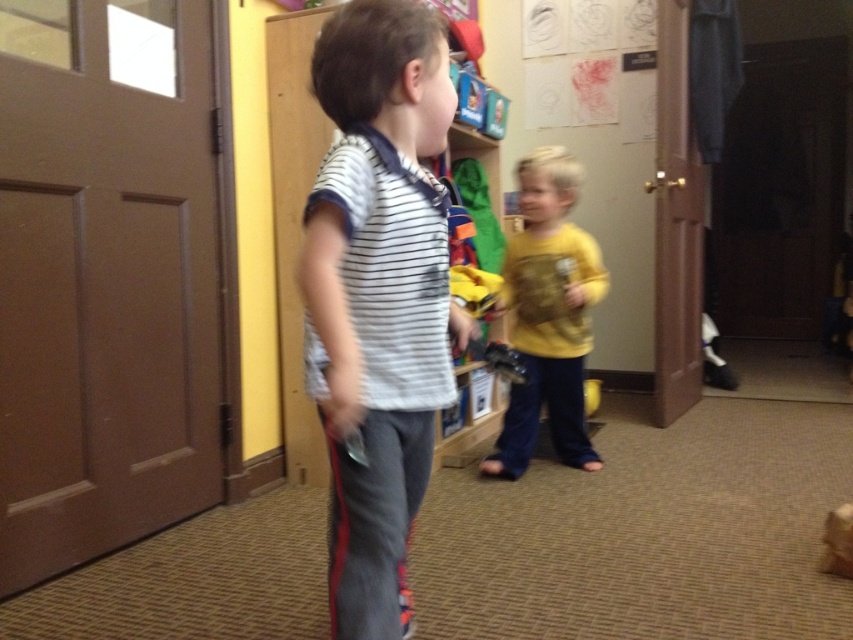
Question: Is white striped shirt at center thinner than yellow matte shirt at center?

Choices:
 (A) yes
 (B) no

Answer: (A)

Question: Does white striped shirt at center have a greater width compared to yellow matte shirt at center?

Choices:
 (A) no
 (B) yes

Answer: (A)

Question: Is the position of white striped shirt at center less distant than that of yellow matte shirt at center?

Choices:
 (A) no
 (B) yes

Answer: (B)

Question: Which point is farther from the camera taking this photo?

Choices:
 (A) (412, 493)
 (B) (508, 420)

Answer: (B)

Question: Which point is closer to the camera taking this photo?

Choices:
 (A) (532, 400)
 (B) (351, 474)

Answer: (B)

Question: Among these objects, which one is farthest from the camera?

Choices:
 (A) yellow matte shirt at center
 (B) white striped shirt at center

Answer: (A)